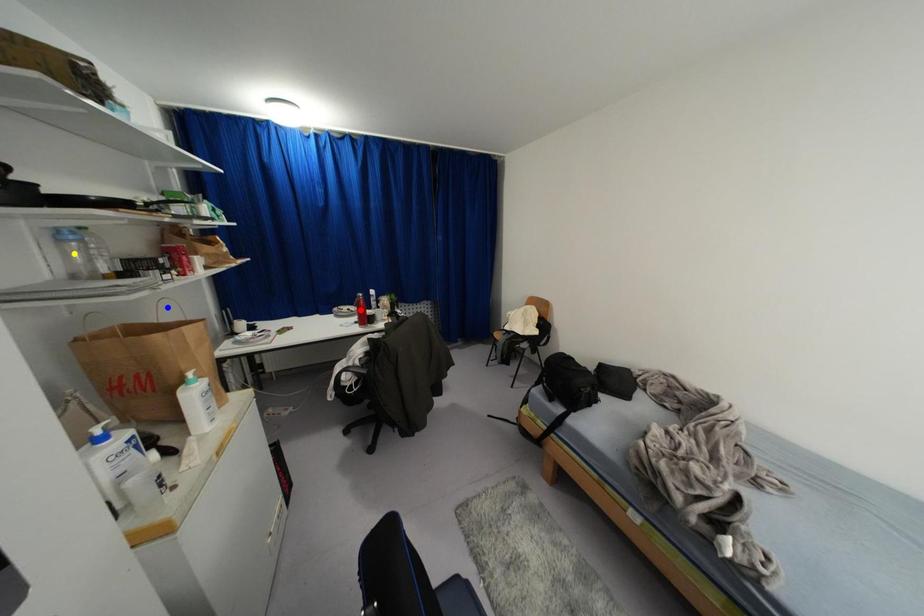
Order these from nearest to farthest:
yellow point | red point | blue point

yellow point < blue point < red point